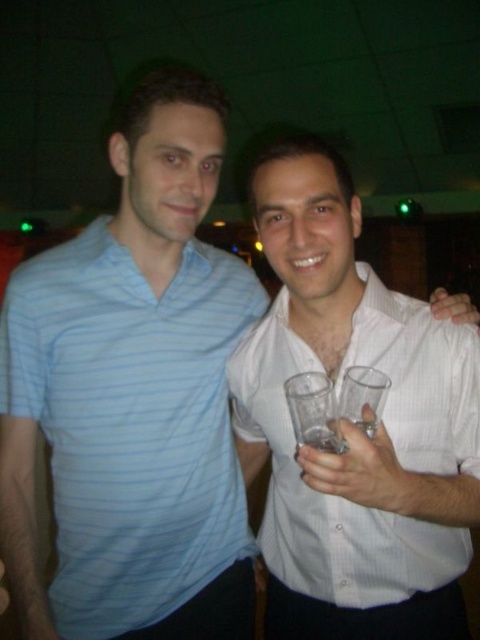
You are a bartender preparing drinks for two guests. One is wearing a light blue striped polo at left and the other has a clear plastic glass at center. Which guest should you approach first if you want to serve the drink to the taller person?

The light blue striped polo at left is much taller than the clear plastic glass at center, so you should approach the guest wearing the light blue striped polo at left first.

You are a bartender preparing drinks for two guests. You have a white textured shirt at center and a clear plastic glass at center in your line of sight. Which object should you prioritize reaching for if you need to grab the taller item first?

The white textured shirt at center is taller than the clear plastic glass at center, so you should prioritize reaching for the white textured shirt at center first.

You are a bartender preparing drinks for two guests. You have a white textured shirt at center and a clear glass at center on the counter. If the distance between them is exactly 10.22 inches, can you place a third glass between them without moving the existing items?

The white textured shirt at center and clear glass at center are 10.22 inches apart. To place a third glass between them without moving the existing items, the third glass must fit within this space. Since the required space depends on the size of the third glass, but the distance between the two items is fixed, it is possible only if the third glass is small enough to fit within the 10.22 inches gap. However, without knowing the exact size of the third glass, we cannot definitively confirm if it will fit.